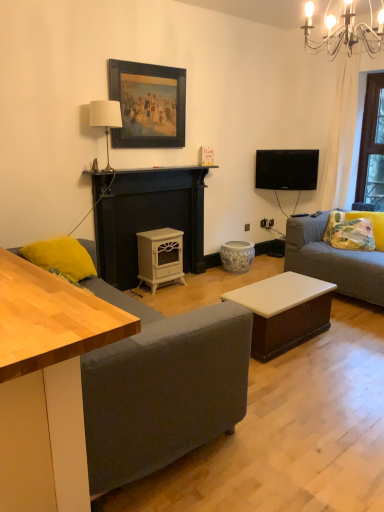
Question: Is light wood desk at left inside or outside of black glossy tv at upper right?

Choices:
 (A) outside
 (B) inside

Answer: (A)

Question: In the image, is light wood desk at left positioned in front of or behind black glossy tv at upper right?

Choices:
 (A) behind
 (B) front

Answer: (B)

Question: Which object is positioned farthest from the black glossy tv at upper right?

Choices:
 (A) white fabric lampshade at upper center
 (B) dark gray fabric couch at lower left
 (C) porcelain floral-patterned stool at center
 (D) gray fabric couch at right
 (E) floral fabric pillow at right, which appears as the second pillow when viewed from the front

Answer: (B)

Question: Which object is the farthest from the white matte wood stove at center?

Choices:
 (A) metallic chandelier at upper right
 (B) floral fabric pillow at right, positioned as the 1th pillow in right-to-left order
 (C) black glossy tv at upper right
 (D) white glossy wood stove at center
 (E) light wood desk at left

Answer: (E)